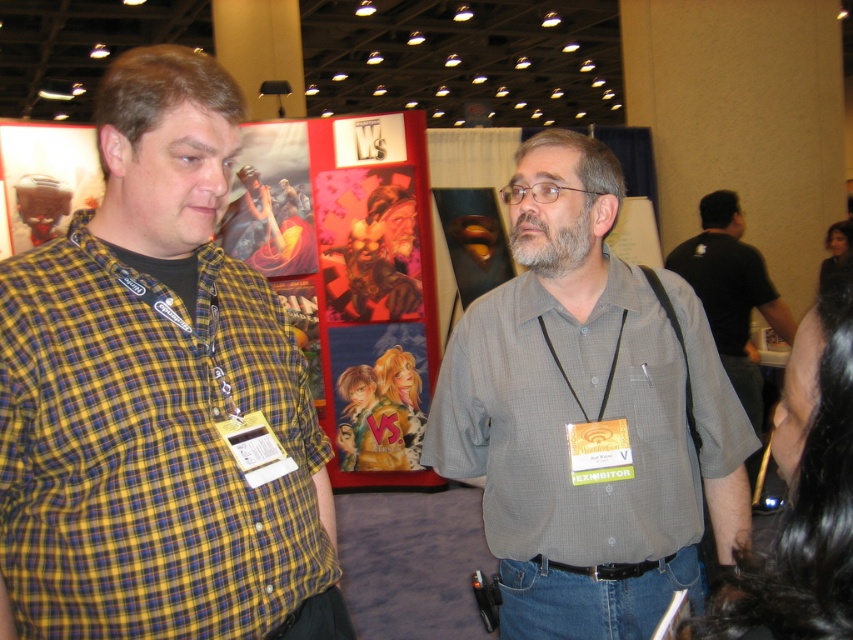
Who is more forward, [520,330] or [735,243]?

Positioned in front is point [520,330].

Is point (523, 561) in front of point (741, 330)?

Yes, point (523, 561) is closer to viewer.

Find the location of a particular element. gray checkered shirt at center is located at coordinates (587, 413).

Can you confirm if yellow plaid shirt at left is smaller than gray checkered shirt at center?

Yes.

Between yellow plaid shirt at left and gray checkered shirt at center, which one appears on the left side from the viewer's perspective?

From the viewer's perspective, yellow plaid shirt at left appears more on the left side.

Is point (109, 573) closer to viewer compared to point (578, 250)?

Yes, it is.

This screenshot has width=853, height=640. Find the location of `yellow plaid shirt at left`. yellow plaid shirt at left is located at coordinates (158, 397).

Can you confirm if yellow plaid shirt at left is positioned to the right of black shirt at right?

Incorrect, yellow plaid shirt at left is not on the right side of black shirt at right.

Is point (131, 220) positioned behind point (734, 262)?

No, (131, 220) is closer to viewer.

Which is in front, point (164, 433) or point (740, 241)?

Positioned in front is point (164, 433).

Image resolution: width=853 pixels, height=640 pixels. Identify the location of yellow plaid shirt at left. (158, 397).